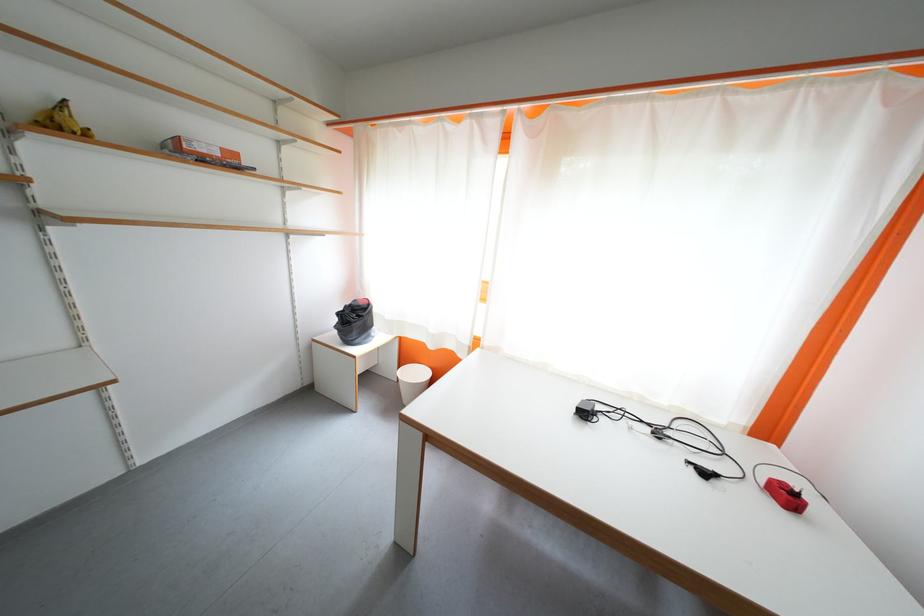
The image size is (924, 616). Find the location of `black power adapter`. black power adapter is located at coordinates (667, 435).